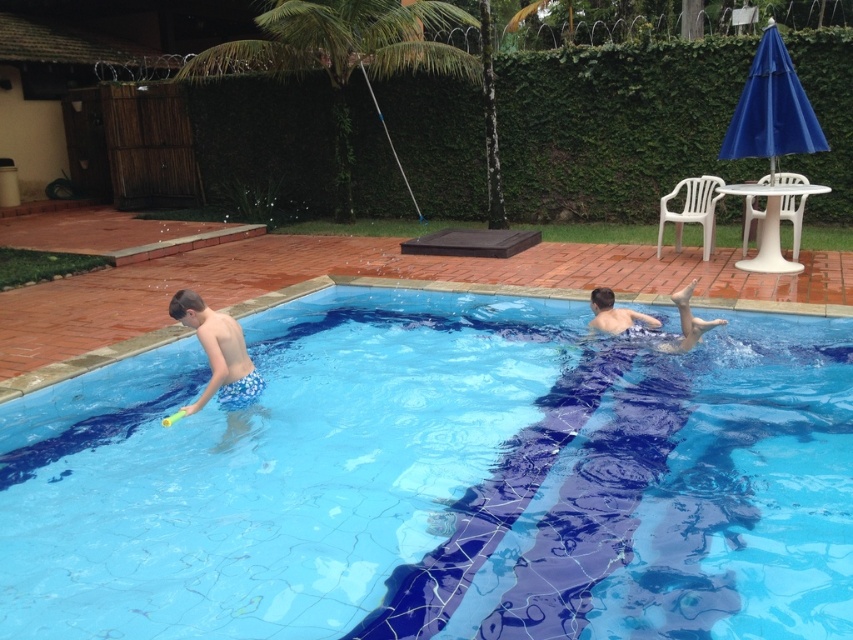
Consider the image. You are standing at the edge of the pool and want to place a small floating toy between the two points labeled point (x=234, y=390) and point (x=625, y=321). Which point should you aim for to ensure the toy is closer to the pool edge?

Point (x=234, y=390) is in front of point (x=625, y=321), so placing the toy near point (x=234, y=390) would be closer to the pool edge.

You are a guest at a backyard pool party and see the blue mosaic tiles at center and the blue printed shorts at lower left. Which object is closer to the pool water?

The blue mosaic tiles at center are closer to the pool water because they are located below the blue printed shorts at lower left, meaning they are positioned lower in the scene and likely near the water edge.

You are standing at the edge of the pool and want to place a small decorative item exactly at point (440, 483). What will be under your item when you place it there?

The blue mosaic tiles at center will be under the item placed at point (440, 483).